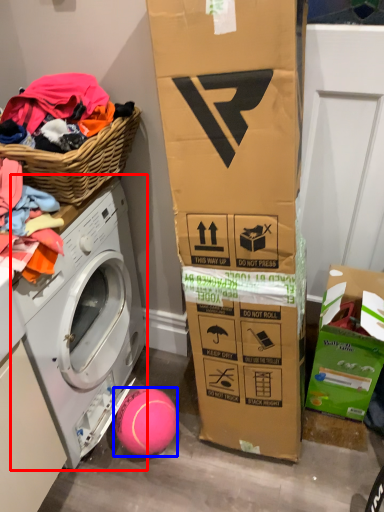
Question: Which of the following is the closest to the observer, washing machine (highlighted by a red box) or ball (highlighted by a blue box)?

Choices:
 (A) washing machine
 (B) ball

Answer: (A)